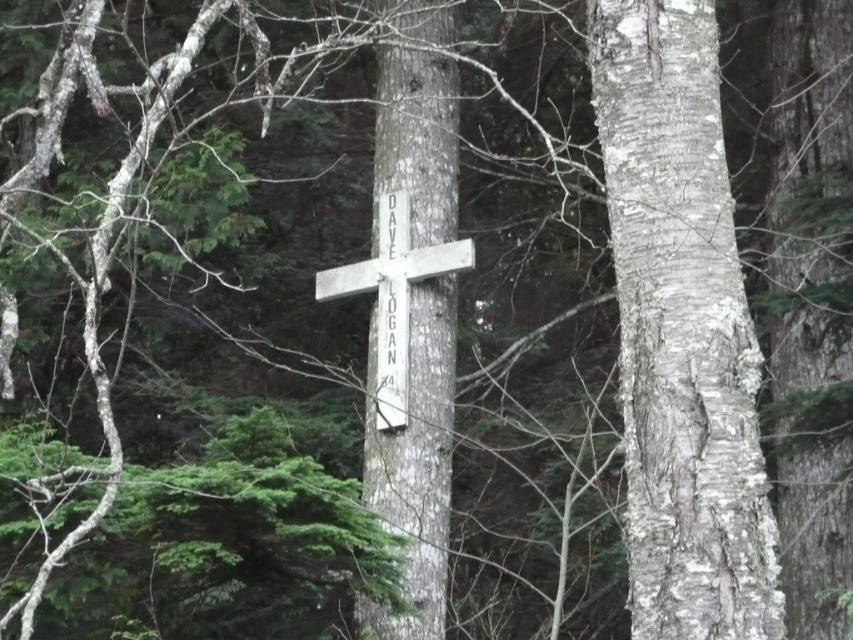
Question: Is smooth bark tree trunk at center further to camera compared to white wood cross at center?

Choices:
 (A) no
 (B) yes

Answer: (A)

Question: Estimate the real-world distances between objects in this image. Which object is closer to the white wood cross at center?

Choices:
 (A) smooth bark tree trunk at center
 (B) white rough bark cross at center

Answer: (B)

Question: Does smooth bark tree trunk at center have a greater width compared to white rough bark cross at center?

Choices:
 (A) yes
 (B) no

Answer: (A)

Question: Can you confirm if smooth bark tree trunk at center is thinner than white rough bark cross at center?

Choices:
 (A) yes
 (B) no

Answer: (B)

Question: Estimate the real-world distances between objects in this image. Which object is farther from the smooth bark tree trunk at center?

Choices:
 (A) white rough bark cross at center
 (B) white wood cross at center

Answer: (A)

Question: Which point is farther to the camera?

Choices:
 (A) (440, 83)
 (B) (714, 465)
 (C) (397, 317)

Answer: (A)